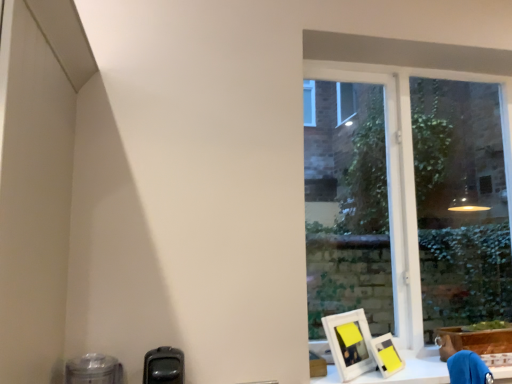
Question: Do you think white matte picture frame at lower right, which appears as the 1th picture frame when viewed from the left, is within matte yellow picture frame at lower right, which is the 2th picture frame in left-to-right order, or outside of it?

Choices:
 (A) inside
 (B) outside

Answer: (B)

Question: From a real-world perspective, is white matte picture frame at lower right, which appears as the 1th picture frame when viewed from the left, positioned above or below matte yellow picture frame at lower right, which is the 2th picture frame in left-to-right order?

Choices:
 (A) above
 (B) below

Answer: (A)

Question: Which of these objects is positioned farthest from the transparent glass window at right?

Choices:
 (A) blue fabric swivel chair at lower right
 (B) brown cardboard box at lower right
 (C) white matte picture frame at lower right, which is the second picture frame from right to left
 (D) matte yellow picture frame at lower right, which is the 2th picture frame in left-to-right order
 (E) white matte workbench at lower right

Answer: (A)

Question: Which of these objects is positioned farthest from the brown cardboard box at lower right?

Choices:
 (A) transparent glass window at right
 (B) blue fabric swivel chair at lower right
 (C) matte yellow picture frame at lower right, the 1th picture frame viewed from the right
 (D) white matte picture frame at lower right, which is the second picture frame from right to left
 (E) white matte workbench at lower right

Answer: (A)